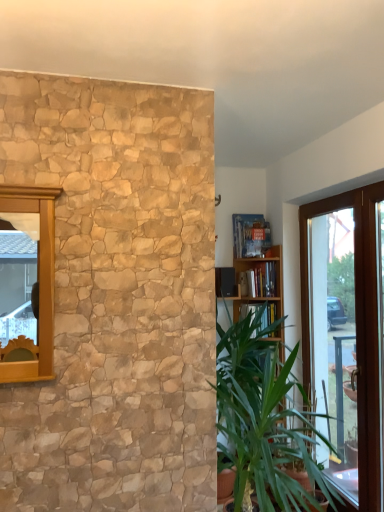
Question: Should I look upward or downward to see green leafy plant at right?

Choices:
 (A) down
 (B) up

Answer: (A)

Question: Is green leafy plant at right shorter than transparent glass door at right?

Choices:
 (A) no
 (B) yes

Answer: (B)

Question: Is the surface of green leafy plant at right in direct contact with transparent glass door at right?

Choices:
 (A) yes
 (B) no

Answer: (B)

Question: From the image's perspective, is green leafy plant at right located above transparent glass door at right?

Choices:
 (A) yes
 (B) no

Answer: (B)

Question: Is green leafy plant at right closer to camera compared to transparent glass door at right?

Choices:
 (A) yes
 (B) no

Answer: (A)

Question: Does green leafy plant at right have a smaller size compared to transparent glass door at right?

Choices:
 (A) yes
 (B) no

Answer: (B)

Question: Is green leafy plant at right surrounding transparent glass door at right?

Choices:
 (A) no
 (B) yes

Answer: (A)

Question: Is hardcover book at upper center, the 1th book when ordered from top to bottom, looking in the opposite direction of hardcover book at center, the first book from the bottom?

Choices:
 (A) yes
 (B) no

Answer: (B)

Question: From the image's perspective, would you say hardcover book at upper center, the 1th book when ordered from top to bottom, is shown under hardcover book at center, the 2th book from the top?

Choices:
 (A) yes
 (B) no

Answer: (B)

Question: Is hardcover book at upper center, placed as the second book when sorted from bottom to top, smaller than hardcover book at center, the first book from the bottom?

Choices:
 (A) yes
 (B) no

Answer: (B)

Question: Is hardcover book at center, the 2th book from the top, surrounded by hardcover book at upper center, the 1th book when ordered from top to bottom?

Choices:
 (A) yes
 (B) no

Answer: (B)

Question: Does hardcover book at upper center, the 1th book when ordered from top to bottom, have a lesser height compared to hardcover book at center, the first book from the bottom?

Choices:
 (A) yes
 (B) no

Answer: (B)

Question: Considering the relative sizes of hardcover book at upper center, the 1th book when ordered from top to bottom, and hardcover book at center, the first book from the bottom, in the image provided, is hardcover book at upper center, the 1th book when ordered from top to bottom, bigger than hardcover book at center, the first book from the bottom,?

Choices:
 (A) yes
 (B) no

Answer: (A)

Question: Is hardcover book at center, the first book from the bottom, not within green leafy plant at right?

Choices:
 (A) no
 (B) yes

Answer: (B)